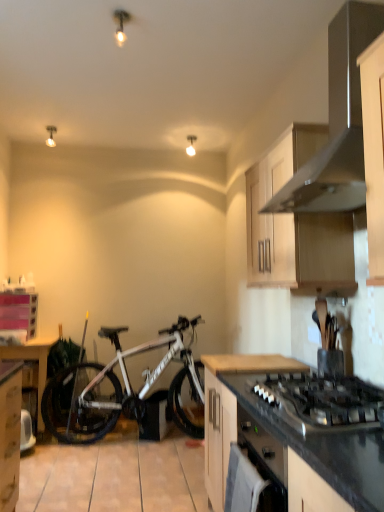
Question: In the image, is matte white light fixture at upper center, arranged as the first light fixture when viewed from the right, positioned in front of or behind wooden at center, which is counted as the second countertop, starting from the bottom?

Choices:
 (A) behind
 (B) front

Answer: (A)

Question: Looking at their shapes, would you say matte white light fixture at upper center, the 2th light fixture when ordered from front to back, is wider or thinner than wooden at center, which is counted as the second countertop, starting from the bottom?

Choices:
 (A) wide
 (B) thin

Answer: (B)

Question: Estimate the real-world distances between objects in this image. Which object is farther from the satin silver range hood at upper right?

Choices:
 (A) black matte gas stove at lower right
 (B) wooden table at left
 (C) white metallic bicycle at lower left
 (D) matte white light fixture at upper center, the 2th light fixture when ordered from front to back
 (E) wooden at center, which appears as the 1th countertop when viewed from the top

Answer: (B)

Question: Which of these objects is positioned closest to the wooden cabinet at upper right, the 2th cabinetry in the left-to-right sequence?

Choices:
 (A) black granite countertop at lower right, which ranks as the 1th countertop in bottom-to-top order
 (B) pink plastic container at left, marked as the 1th cabinetry in a bottom-to-top arrangement
 (C) white metallic bicycle at lower left
 (D) matte white light fixture at upper left, the first light fixture positioned from the front
 (E) satin silver range hood at upper right

Answer: (E)